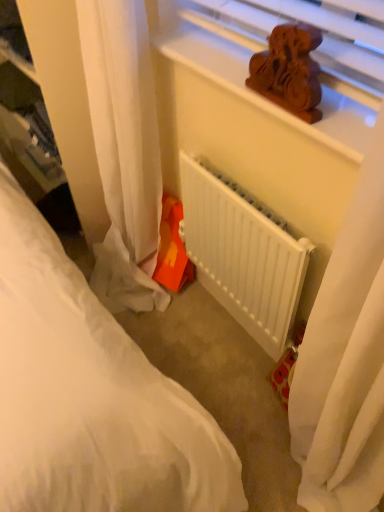
Image resolution: width=384 pixels, height=512 pixels. I want to click on vacant location below white sheer curtain at lower left (from a real-world perspective), so [123, 298].